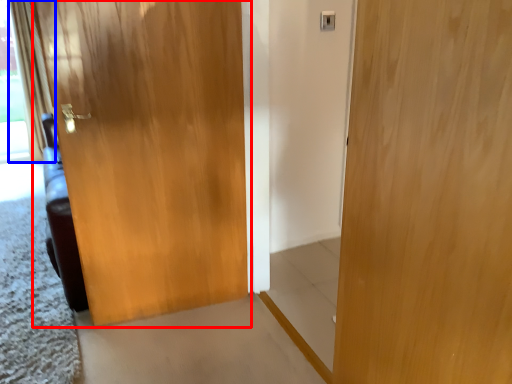
Question: Among these objects, which one is nearest to the camera, door (highlighted by a red box) or curtain (highlighted by a blue box)?

Choices:
 (A) door
 (B) curtain

Answer: (A)